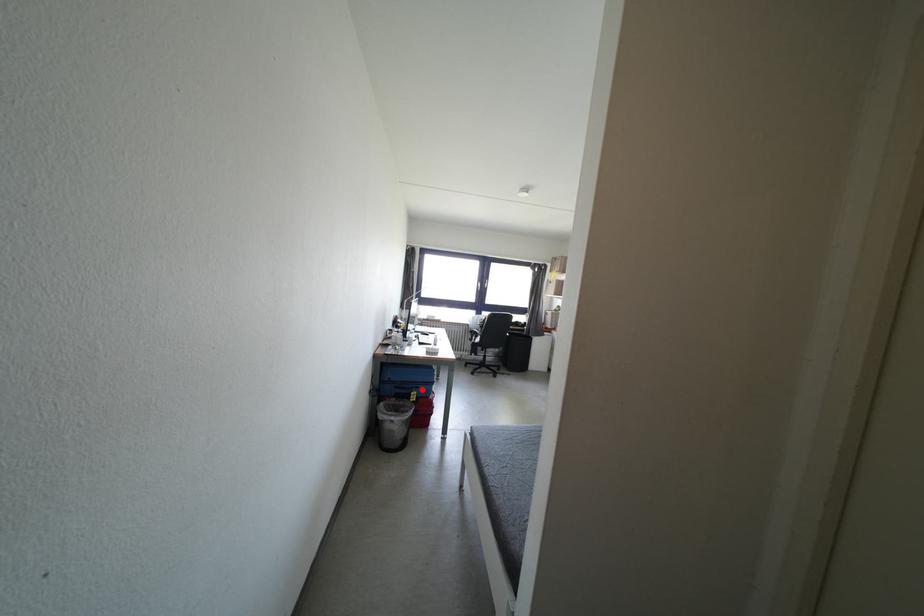
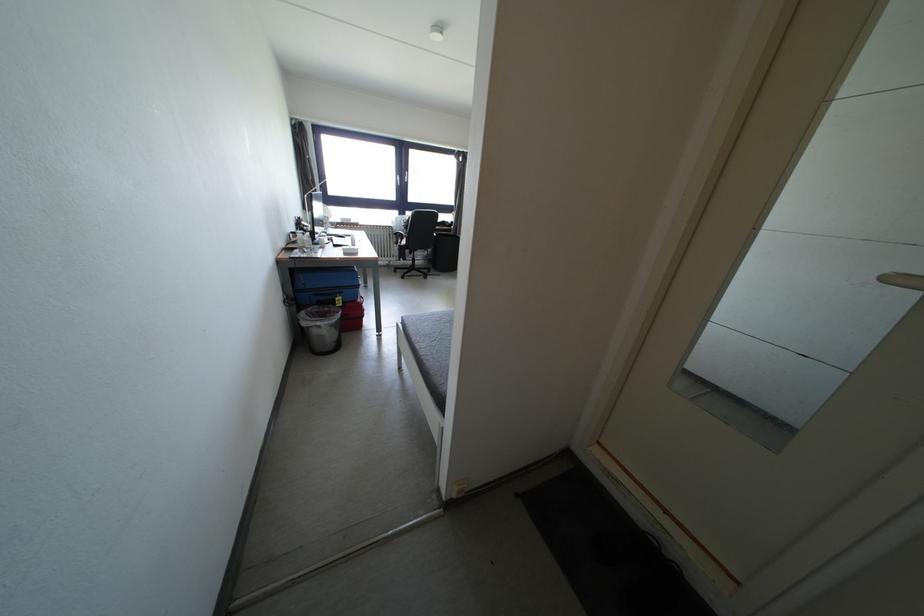
Question: I am providing you with two images of the same scene from different viewpoints. Given a red point in image1, look at the same physical point in image2. Is it:

Choices:
 (A) Closer to the viewpoint
 (B) Farther from the viewpoint

Answer: (A)